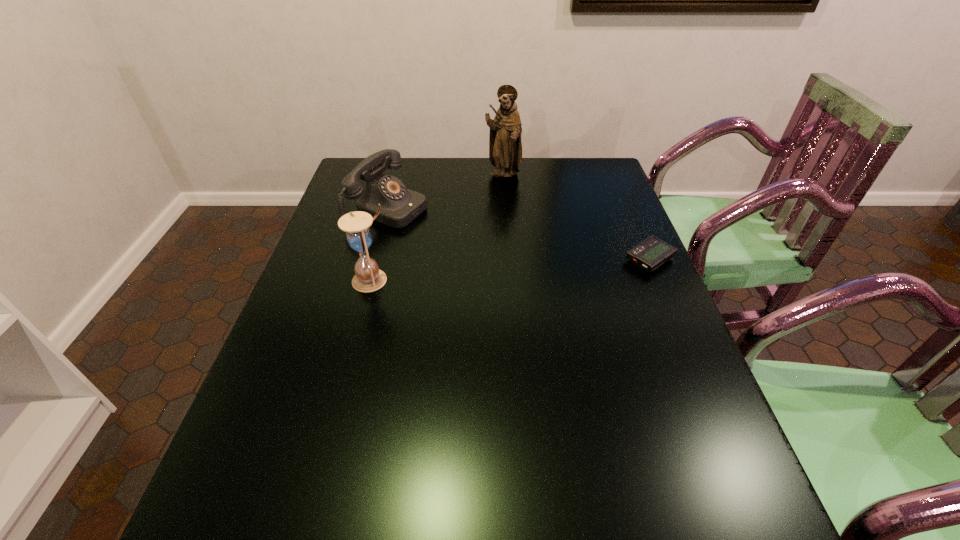
The height and width of the screenshot is (540, 960). What are the coordinates of `vacant space on the desktop that is between the hourglass and the beeper and is positioned on the dial of the second farthest object` in the screenshot? It's located at (550, 267).

Identify the location of free space on the desktop that is between the hourglass and the beeper and is positioned on the front-facing side of the farthest object. (530, 268).